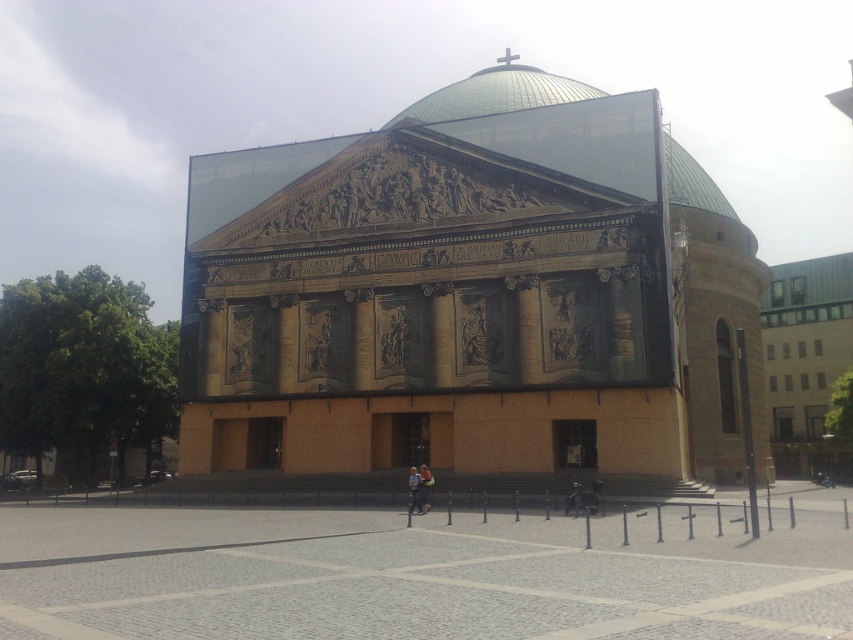
Can you confirm if green metal building at right is taller than light blue denim jacket at center?

Yes.

Measure the distance between green metal building at right and camera.

Result: A distance of 83.39 meters exists between green metal building at right and camera.

Is point (833, 316) farther from camera compared to point (428, 497)?

Yes, point (833, 316) is behind point (428, 497).

Locate an element on the screen. green metal building at right is located at coordinates (805, 358).

What do you see at coordinates (424, 486) in the screenshot? I see `light blue denim jacket at center` at bounding box center [424, 486].

Who is positioned more to the left, light blue denim jacket at center or light blue fabric jacket at center?

light blue fabric jacket at center

Who is more forward, (428, 506) or (416, 502)?

Point (416, 502)

At what (x,y) coordinates should I click in order to perform the action: click on light blue denim jacket at center. Please return your answer as a coordinate pair (x, y). This screenshot has height=640, width=853. Looking at the image, I should click on (424, 486).

Between green metal building at right and light blue fabric jacket at center, which one appears on the right side from the viewer's perspective?

green metal building at right

Which is in front, point (807, 355) or point (412, 492)?

Positioned in front is point (412, 492).

Where is `green metal building at right`? The height and width of the screenshot is (640, 853). green metal building at right is located at coordinates (805, 358).